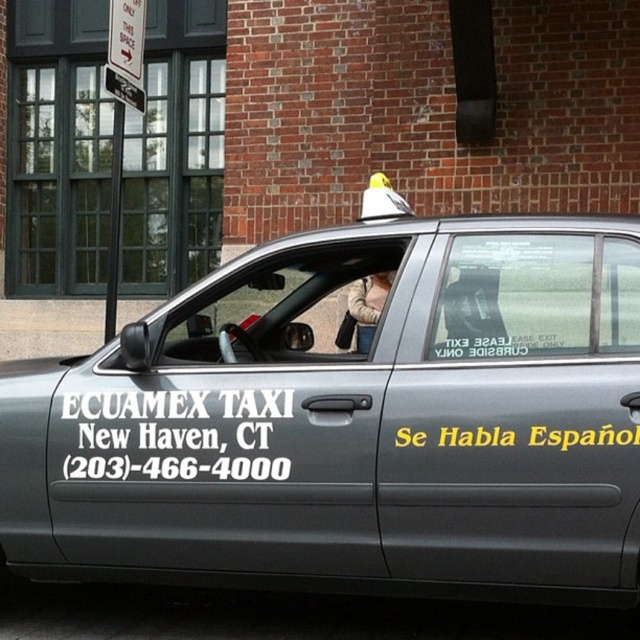
Consider the image. Does metallic gray taxi at center have a greater width compared to beige fuzzy jacket at center?

Yes, metallic gray taxi at center is wider than beige fuzzy jacket at center.

Consider the image. Is metallic gray taxi at center closer to the viewer compared to beige fuzzy jacket at center?

Yes.

Measure the distance between point (118, 577) and camera.

Point (118, 577) is 4.23 meters away from camera.

This screenshot has height=640, width=640. In order to click on metallic gray taxi at center in this screenshot , I will do `click(352, 420)`.